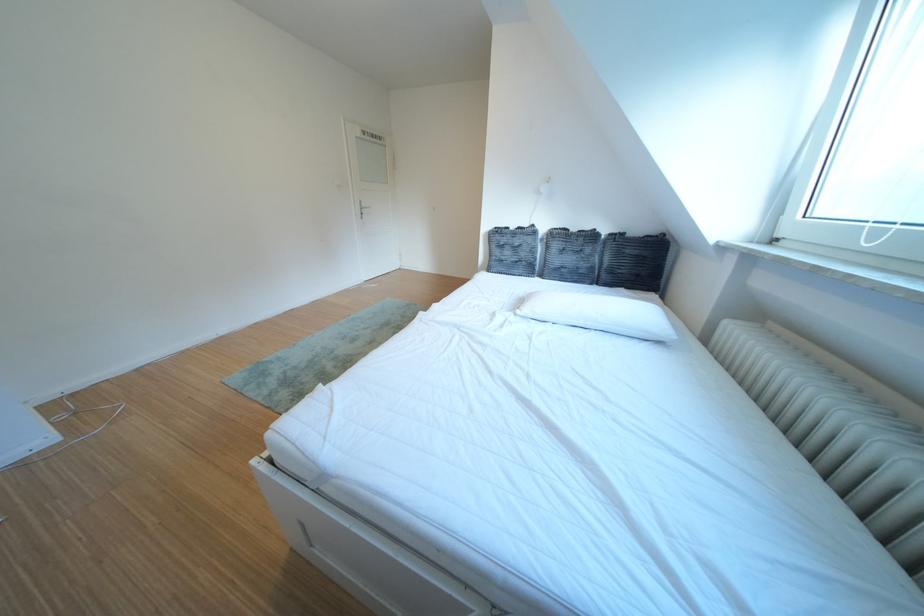
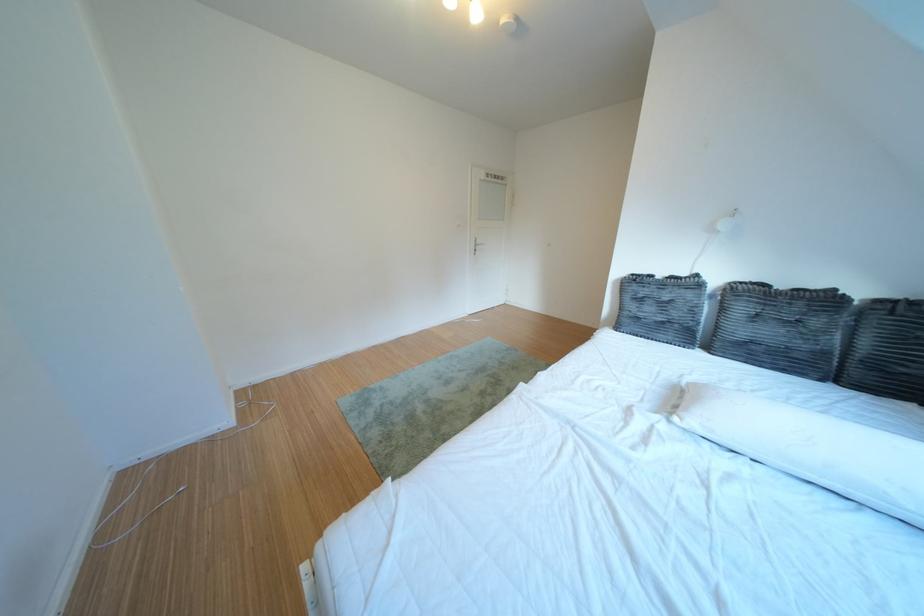
Locate, in the second image, the point that corresponds to the point at 630,238 in the first image.

(910, 306)